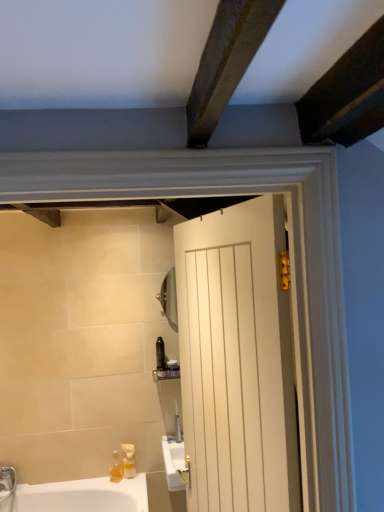
Question: Considering the positions of point (127, 459) and point (117, 467), is point (127, 459) closer or farther from the camera than point (117, 467)?

Choices:
 (A) farther
 (B) closer

Answer: (A)

Question: In the image, is translucent yellow plastic at lower left, placed as the 1th soap dispenser when sorted from right to left, positioned in front of or behind translucent plastic soap dispenser at lower left, acting as the 2th soap dispenser starting from the right?

Choices:
 (A) front
 (B) behind

Answer: (B)

Question: Which object is the closest to the translucent yellow plastic at lower left, placed as the 1th soap dispenser when sorted from right to left?

Choices:
 (A) white wooden door at center
 (B) translucent plastic bottle at center, positioned as the second toiletry in right-to-left order
 (C) translucent plastic container at center, the second toiletry positioned from the left
 (D) translucent plastic soap dispenser at lower left, acting as the 2th soap dispenser starting from the right

Answer: (D)

Question: Estimate the real-world distances between objects in this image. Which object is farther from the translucent plastic bottle at center, positioned as the second toiletry in right-to-left order?

Choices:
 (A) translucent plastic container at center, the second toiletry positioned from the left
 (B) white wooden door at center
 (C) translucent yellow plastic at lower left, placed as the 1th soap dispenser when sorted from right to left
 (D) translucent plastic soap dispenser at lower left, acting as the 2th soap dispenser starting from the right

Answer: (B)